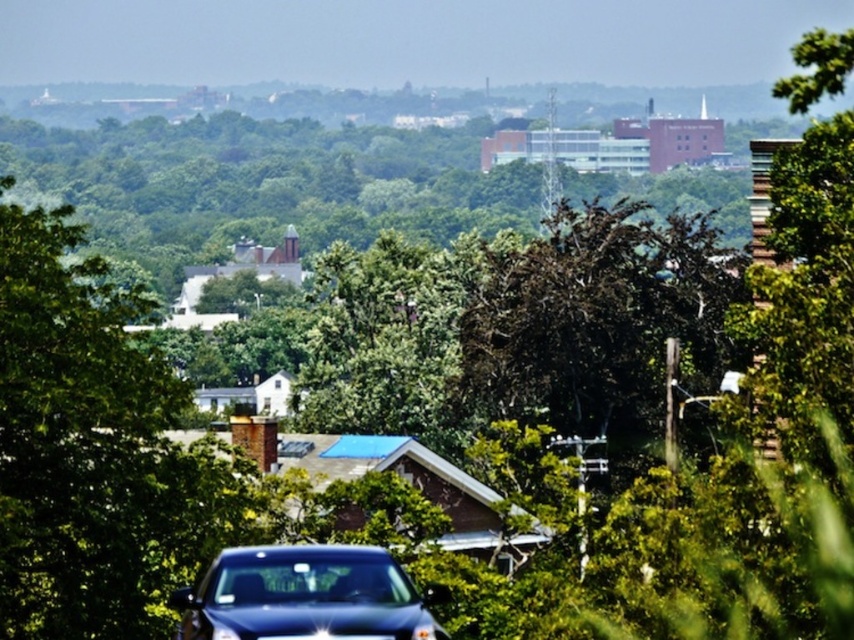
You are a delivery person trying to navigate through the suburban area shown in the image. You need to deliver a package to the house with the blue roof. From your current position near the glossy dark blue car at lower center, which direction should you head to reach the house with the blue roof, considering the green leafy tree at center is blocking your path?

The green leafy tree at center is to the left of the glossy dark blue car at lower center. To avoid the tree, you should head to the right side of the glossy dark blue car at lower center to reach the house with the blue roof.

You are a delivery driver who needs to park your vehicle in this area. You see the green leafy tree at center and the glossy dark blue car at lower center. Which object takes up more space horizontally in the image?

The green leafy tree at center takes up more space horizontally in the image because its width is larger than that of the glossy dark blue car at lower center.